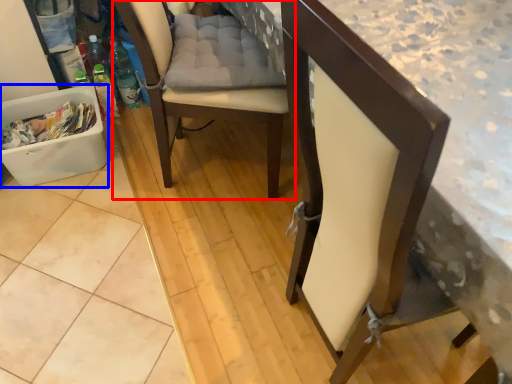
Question: Which point is closer to the camera, chair (highlighted by a red box) or laundry basket (highlighted by a blue box)?

Choices:
 (A) chair
 (B) laundry basket

Answer: (A)